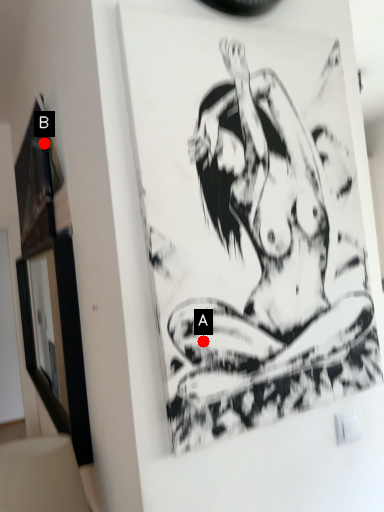
Question: Two points are circled on the image, labeled by A and B beside each circle. Which point appears closest to the camera in this image?

Choices:
 (A) A is closer
 (B) B is closer

Answer: (A)